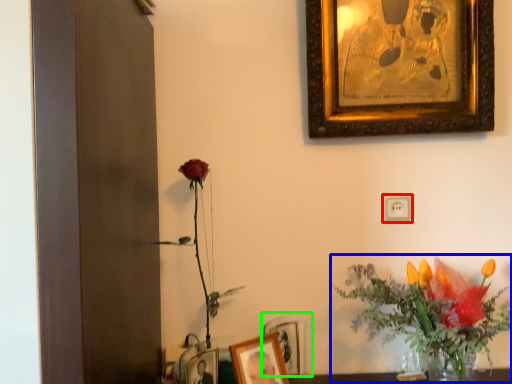
Question: Estimate the real-world distances between objects in this image. Which object is farther from electric outlet (highlighted by a red box), floral arrangement (highlighted by a blue box) or picture frame (highlighted by a green box)?

Choices:
 (A) floral arrangement
 (B) picture frame

Answer: (B)